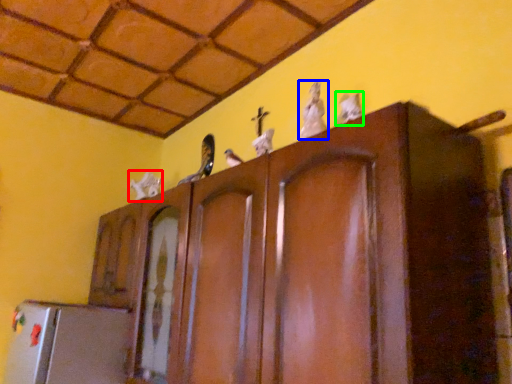
Question: Based on their relative distances, which object is farther from animal (highlighted by a red box)? Choose from animal (highlighted by a blue box) and animal (highlighted by a green box).

Choices:
 (A) animal
 (B) animal

Answer: (B)